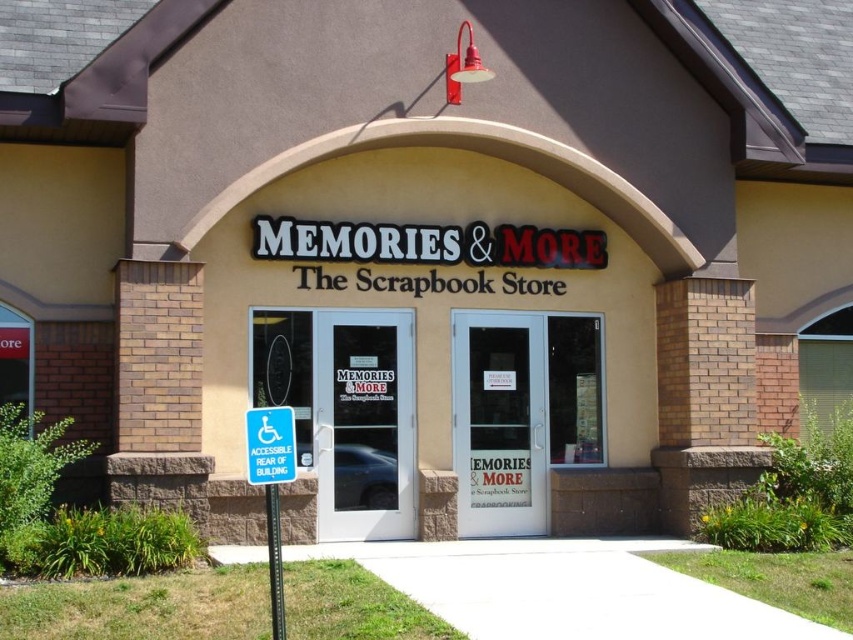
Is point (395, 452) behind point (273, 461)?

Yes, it is behind point (273, 461).

From the picture: Can you confirm if transparent glass door at center is positioned to the right of blue plastic sign at center?

Indeed, transparent glass door at center is positioned on the right side of blue plastic sign at center.

Locate an element on the screen. The width and height of the screenshot is (853, 640). transparent glass door at center is located at coordinates (364, 422).

This screenshot has height=640, width=853. Identify the location of transparent glass door at center. (364, 422).

Which of these two, transparent glass door at center or clear glass door at center, stands shorter?

transparent glass door at center

Does transparent glass door at center appear under clear glass door at center?

Actually, transparent glass door at center is above clear glass door at center.

You are a GUI agent. You are given a task and a screenshot of the screen. Output one action in this format:
    pyautogui.click(x=<x>, y=<y>)
    Task: Click on the transparent glass door at center
    Image resolution: width=853 pixels, height=640 pixels.
    Given the screenshot: What is the action you would take?
    pyautogui.click(x=364, y=422)

Which of these two, transparent glass door at center or blue plastic sign at lower left, stands shorter?

With less height is blue plastic sign at lower left.

Is transparent glass door at center to the right of blue plastic sign at lower left from the viewer's perspective?

Indeed, transparent glass door at center is positioned on the right side of blue plastic sign at lower left.

This screenshot has width=853, height=640. What are the coordinates of `transparent glass door at center` in the screenshot? It's located at (364, 422).

Identify the location of transparent glass door at center. This screenshot has height=640, width=853. (364, 422).